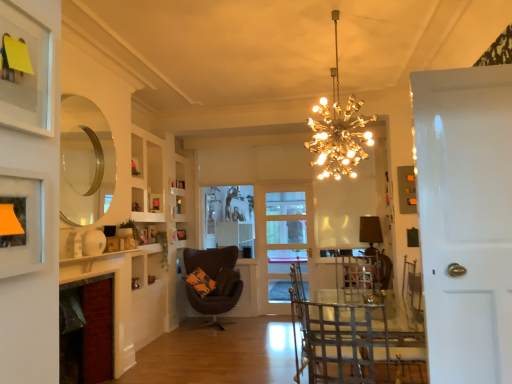
Question: Can you confirm if clear glass mirror at upper left is bigger than metallic wire armchair at center?

Choices:
 (A) no
 (B) yes

Answer: (A)

Question: From the image's perspective, is clear glass mirror at upper left on metallic wire armchair at center?

Choices:
 (A) yes
 (B) no

Answer: (A)

Question: Does clear glass mirror at upper left lie behind metallic wire armchair at center?

Choices:
 (A) yes
 (B) no

Answer: (A)

Question: Is clear glass mirror at upper left smaller than metallic wire armchair at center?

Choices:
 (A) yes
 (B) no

Answer: (A)

Question: Is clear glass mirror at upper left surrounding metallic wire armchair at center?

Choices:
 (A) no
 (B) yes

Answer: (A)

Question: Does clear glass mirror at upper left lie in front of metallic wire armchair at center?

Choices:
 (A) no
 (B) yes

Answer: (A)

Question: From the image's perspective, is matte black picture frame at upper center, positioned as the 4th picture frame in front-to-back order, beneath gold metallic chandelier at upper center?

Choices:
 (A) yes
 (B) no

Answer: (A)

Question: Could you tell me if matte black picture frame at upper center, positioned as the 4th picture frame in front-to-back order, is facing gold metallic chandelier at upper center?

Choices:
 (A) yes
 (B) no

Answer: (B)

Question: Considering the relative sizes of matte black picture frame at upper center, placed as the 2th picture frame when sorted from back to front, and gold metallic chandelier at upper center in the image provided, is matte black picture frame at upper center, placed as the 2th picture frame when sorted from back to front, taller than gold metallic chandelier at upper center?

Choices:
 (A) no
 (B) yes

Answer: (A)

Question: Is matte black picture frame at upper center, positioned as the 4th picture frame in front-to-back order, at the right side of gold metallic chandelier at upper center?

Choices:
 (A) no
 (B) yes

Answer: (A)

Question: Does matte black picture frame at upper center, placed as the 2th picture frame when sorted from back to front, have a smaller size compared to gold metallic chandelier at upper center?

Choices:
 (A) no
 (B) yes

Answer: (B)

Question: Considering the relative sizes of matte black picture frame at upper center, the 3th picture frame when ordered from left to right, and gold metallic chandelier at upper center in the image provided, is matte black picture frame at upper center, the 3th picture frame when ordered from left to right, thinner than gold metallic chandelier at upper center?

Choices:
 (A) no
 (B) yes

Answer: (B)

Question: Is red brick fireplace at lower left wider than gold metallic chandelier at upper center?

Choices:
 (A) no
 (B) yes

Answer: (A)